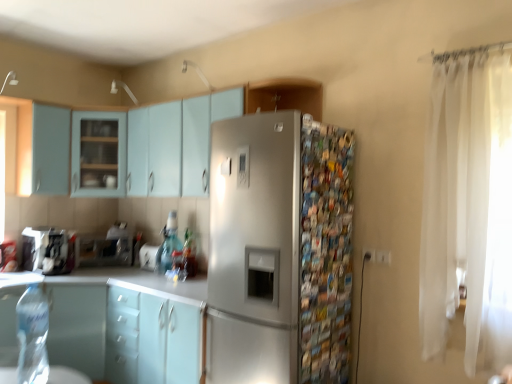
Question: Considering the relative sizes of translucent glass bottle at center, the 1th bottle positioned from the right, and clear glass jar at center, the first appliance in the right-to-left sequence, in the image provided, is translucent glass bottle at center, the 1th bottle positioned from the right, bigger than clear glass jar at center, the first appliance in the right-to-left sequence,?

Choices:
 (A) yes
 (B) no

Answer: (B)

Question: Is there a large distance between translucent glass bottle at center, the 1th bottle positioned from the right, and clear glass jar at center, the first appliance in the right-to-left sequence?

Choices:
 (A) no
 (B) yes

Answer: (A)

Question: Is translucent glass bottle at center, which ranks as the second bottle in back-to-front order, facing towards clear glass jar at center, the first appliance in the right-to-left sequence?

Choices:
 (A) no
 (B) yes

Answer: (A)

Question: Is the depth of translucent glass bottle at center, the 3th bottle in the left-to-right sequence, less than that of clear glass jar at center, the third appliance in the left-to-right sequence?

Choices:
 (A) no
 (B) yes

Answer: (B)

Question: From the image's perspective, is translucent glass bottle at center, the 3th bottle in the left-to-right sequence, located beneath clear glass jar at center, the first appliance in the right-to-left sequence?

Choices:
 (A) yes
 (B) no

Answer: (B)

Question: Considering the relative sizes of translucent glass bottle at center, the second bottle positioned from the front, and clear glass jar at center, the first appliance in the right-to-left sequence, in the image provided, is translucent glass bottle at center, the second bottle positioned from the front, shorter than clear glass jar at center, the first appliance in the right-to-left sequence,?

Choices:
 (A) no
 (B) yes

Answer: (A)

Question: Is satin silver microwave at center, the second appliance when ordered from left to right, looking in the opposite direction of light blue matte cabinet at upper left, arranged as the 2th cabinetry when viewed from the top?

Choices:
 (A) yes
 (B) no

Answer: (B)

Question: Could you tell me if satin silver microwave at center, which ranks as the second appliance in right-to-left order, is facing light blue matte cabinet at upper left, which appears as the sixth cabinetry when ordered from the bottom?

Choices:
 (A) yes
 (B) no

Answer: (B)

Question: Is satin silver microwave at center, which ranks as the second appliance in right-to-left order, to the right of light blue matte cabinet at upper left, arranged as the 2th cabinetry when viewed from the top, from the viewer's perspective?

Choices:
 (A) no
 (B) yes

Answer: (B)

Question: Does satin silver microwave at center, the second appliance when ordered from left to right, lie in front of light blue matte cabinet at upper left, arranged as the 2th cabinetry when viewed from the top?

Choices:
 (A) no
 (B) yes

Answer: (A)

Question: Considering the relative sizes of satin silver microwave at center, the second appliance when ordered from left to right, and light blue matte cabinet at upper left, which appears as the sixth cabinetry when ordered from the bottom, in the image provided, is satin silver microwave at center, the second appliance when ordered from left to right, bigger than light blue matte cabinet at upper left, which appears as the sixth cabinetry when ordered from the bottom,?

Choices:
 (A) no
 (B) yes

Answer: (A)

Question: From the image's perspective, is satin silver microwave at center, which ranks as the second appliance in right-to-left order, beneath light blue matte cabinet at upper left, arranged as the 2th cabinetry when viewed from the top?

Choices:
 (A) yes
 (B) no

Answer: (A)

Question: Can you confirm if satin finish cabinet at upper center, the seventh cabinetry in the bottom-to-top sequence, is wider than matte white cabinet at lower left, placed as the sixth cabinetry when sorted from top to bottom?

Choices:
 (A) no
 (B) yes

Answer: (A)